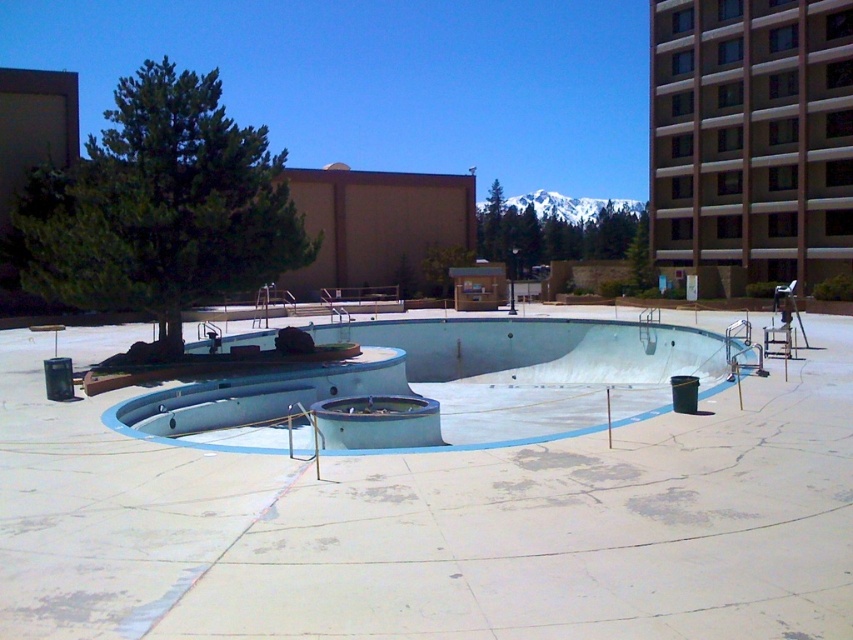
You are planning to install a new water feature between the smooth concrete skate park at center and the smooth concrete pool at center. According to the scene description, which side of the pool should the water feature be placed on?

The smooth concrete skate park at center is positioned on the right side of the smooth concrete pool at center, so the water feature should be placed on the right side of the smooth concrete pool at center.

Consider the image. You are a hotel maintenance worker who needs to inspect both the smooth concrete skate park at center and the smooth concrete pool at center. Which one should you check first if you want to start from the highest point?

You should check the smooth concrete pool at center first because it is located above the smooth concrete skate park at center.